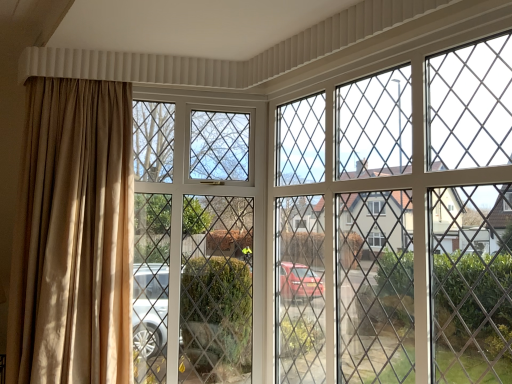
Question: From the image's perspective, would you say clear glass screen door at upper center, which is the first screen door from right to left, is positioned over beige fabric curtain at left?

Choices:
 (A) no
 (B) yes

Answer: (A)

Question: Is the position of clear glass screen door at upper center, which is the first screen door from right to left, less distant than that of beige fabric curtain at left?

Choices:
 (A) no
 (B) yes

Answer: (B)

Question: Is clear glass screen door at upper center, which is the first screen door from right to left, looking in the opposite direction of beige fabric curtain at left?

Choices:
 (A) yes
 (B) no

Answer: (B)

Question: Is clear glass screen door at upper center, which is the first screen door from right to left, smaller than beige fabric curtain at left?

Choices:
 (A) no
 (B) yes

Answer: (A)

Question: Considering the relative sizes of clear glass screen door at upper center, which is the first screen door from right to left, and beige fabric curtain at left in the image provided, is clear glass screen door at upper center, which is the first screen door from right to left, bigger than beige fabric curtain at left?

Choices:
 (A) yes
 (B) no

Answer: (A)

Question: Is clear glass screen door at center, the 1th screen door when ordered from left to right, situated inside clear glass screen door at upper center, which is the 2th screen door in left-to-right order, or outside?

Choices:
 (A) inside
 (B) outside

Answer: (B)

Question: Is clear glass screen door at center, the 2th screen door viewed from the right, taller or shorter than clear glass screen door at upper center, which is the 2th screen door in left-to-right order?

Choices:
 (A) tall
 (B) short

Answer: (A)

Question: Considering the positions of clear glass screen door at center, the 1th screen door when ordered from left to right, and clear glass screen door at upper center, which is the 2th screen door in left-to-right order, in the image, is clear glass screen door at center, the 1th screen door when ordered from left to right, wider or thinner than clear glass screen door at upper center, which is the 2th screen door in left-to-right order,?

Choices:
 (A) wide
 (B) thin

Answer: (A)

Question: From the image's perspective, relative to clear glass screen door at upper center, which is the 2th screen door in left-to-right order, is clear glass screen door at center, the 1th screen door when ordered from left to right, above or below?

Choices:
 (A) above
 (B) below

Answer: (B)

Question: Choose the correct answer: Is clear glass screen door at upper center, which is the 2th screen door in left-to-right order, inside clear glass screen door at center, the 2th screen door viewed from the right, or outside it?

Choices:
 (A) inside
 (B) outside

Answer: (B)

Question: From a real-world perspective, is clear glass screen door at upper center, which is the first screen door from right to left, physically located above or below clear glass screen door at center, the 2th screen door viewed from the right?

Choices:
 (A) above
 (B) below

Answer: (A)

Question: Looking at their shapes, would you say clear glass screen door at upper center, which is the 2th screen door in left-to-right order, is wider or thinner than clear glass screen door at center, the 2th screen door viewed from the right?

Choices:
 (A) wide
 (B) thin

Answer: (B)

Question: From their relative heights in the image, would you say clear glass screen door at upper center, which is the first screen door from right to left, is taller or shorter than clear glass screen door at center, the 1th screen door when ordered from left to right?

Choices:
 (A) tall
 (B) short

Answer: (B)

Question: Looking at their shapes, would you say clear glass screen door at center, the 1th screen door when ordered from left to right, is wider or thinner than beige fabric curtain at left?

Choices:
 (A) thin
 (B) wide

Answer: (A)

Question: In terms of size, does clear glass screen door at center, the 2th screen door viewed from the right, appear bigger or smaller than beige fabric curtain at left?

Choices:
 (A) small
 (B) big

Answer: (A)